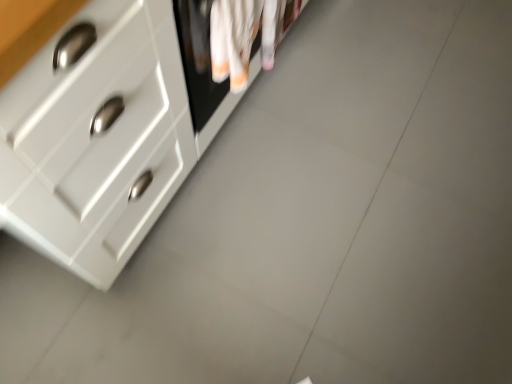
Question: Is the position of white glossy chest of drawers at upper left less distant than that of white cotton laundry at upper center?

Choices:
 (A) no
 (B) yes

Answer: (B)

Question: Is white glossy chest of drawers at upper left thinner than white cotton laundry at upper center?

Choices:
 (A) yes
 (B) no

Answer: (B)

Question: From a real-world perspective, is white glossy chest of drawers at upper left physically below white cotton laundry at upper center?

Choices:
 (A) no
 (B) yes

Answer: (B)

Question: Is white glossy chest of drawers at upper left far from white cotton laundry at upper center?

Choices:
 (A) yes
 (B) no

Answer: (B)

Question: Considering the relative sizes of white glossy chest of drawers at upper left and white cotton laundry at upper center in the image provided, is white glossy chest of drawers at upper left taller than white cotton laundry at upper center?

Choices:
 (A) no
 (B) yes

Answer: (B)

Question: Considering the relative positions of white glossy chest of drawers at upper left and white cotton laundry at upper center in the image provided, is white glossy chest of drawers at upper left to the left of white cotton laundry at upper center from the viewer's perspective?

Choices:
 (A) yes
 (B) no

Answer: (A)

Question: Does white cotton laundry at upper center have a smaller size compared to white glossy chest of drawers at upper left?

Choices:
 (A) no
 (B) yes

Answer: (B)

Question: Is white cotton laundry at upper center wider than white glossy chest of drawers at upper left?

Choices:
 (A) no
 (B) yes

Answer: (A)

Question: Could white glossy chest of drawers at upper left be considered to be inside white cotton laundry at upper center?

Choices:
 (A) yes
 (B) no

Answer: (B)

Question: Can you confirm if white cotton laundry at upper center is positioned to the right of white glossy chest of drawers at upper left?

Choices:
 (A) yes
 (B) no

Answer: (A)

Question: Would you say white cotton laundry at upper center is a long distance from white glossy chest of drawers at upper left?

Choices:
 (A) yes
 (B) no

Answer: (B)

Question: Is white cotton laundry at upper center beside white glossy chest of drawers at upper left?

Choices:
 (A) yes
 (B) no

Answer: (B)

Question: Based on their sizes in the image, would you say white cotton laundry at upper center is bigger or smaller than white glossy chest of drawers at upper left?

Choices:
 (A) small
 (B) big

Answer: (A)